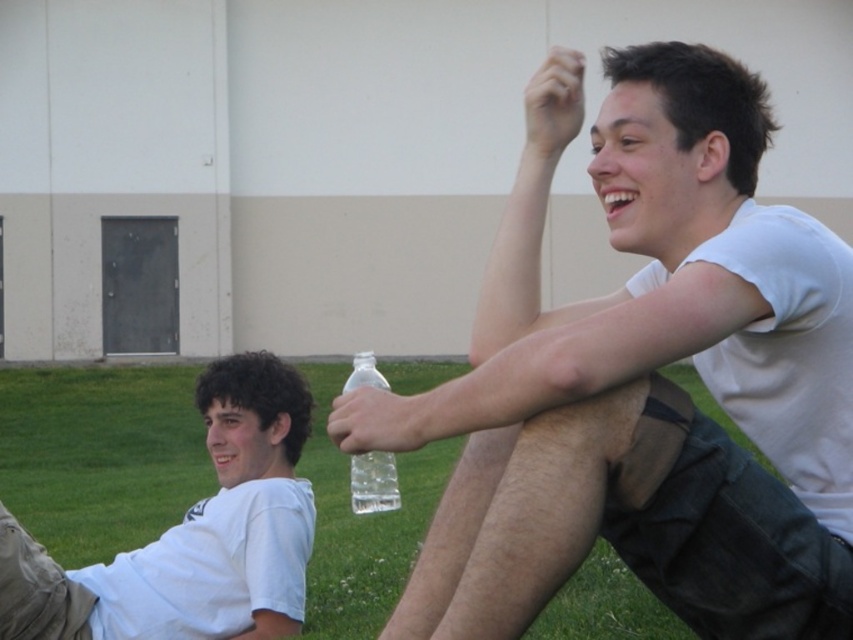
You are standing at the point with coordinates [100,456] in the image. What is located at that exact point?

At point [100,456] lies green grass at lower center.

You are standing in front of the building and want to take a photo of the white matte shirt at upper right and the green grass at lower center. Which object is higher in the image?

The white matte shirt at upper right is located above the green grass at lower center, so it is higher in the image.

You are planning to place a small picnic basket on the green grass at lower center. However, you want to ensure it won not be obstructed by the white matte shirt at lower left. Based on the scene, can you determine if the basket will be visible once placed there?

The green grass at lower center is located below the white matte shirt at lower left, so placing the picnic basket there may be obstructed by the shirt, making it less visible.